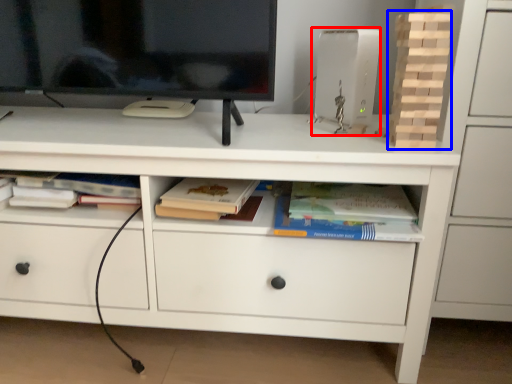
Question: Which object is closer to the camera taking this photo, equipment (highlighted by a red box) or book (highlighted by a blue box)?

Choices:
 (A) equipment
 (B) book

Answer: (B)